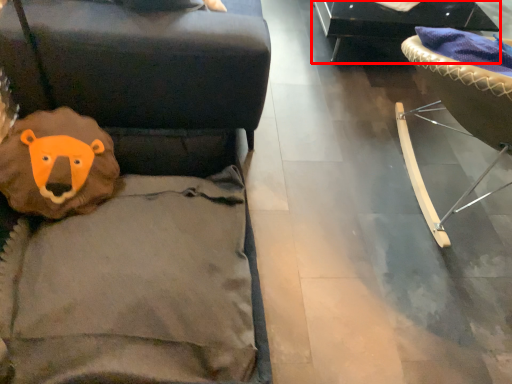
Question: Observing the image, what is the correct spatial positioning of furniture (annotated by the red box) in reference to furniture?

Choices:
 (A) left
 (B) right

Answer: (A)